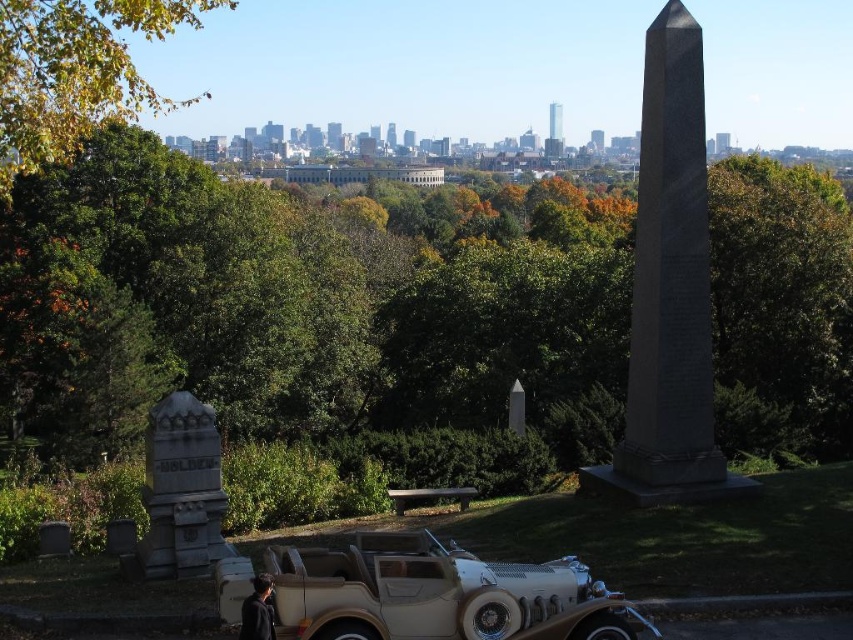
Question: Which of these objects is positioned farthest from the granite obelisk at center?

Choices:
 (A) green leafy tree at upper left
 (B) gray stone monument at lower left

Answer: (A)

Question: Observing the image, what is the correct spatial positioning of granite obelisk at center in reference to green leafy tree at upper left?

Choices:
 (A) below
 (B) above

Answer: (A)

Question: Estimate the real-world distances between objects in this image. Which object is farther from the green leafy tree at upper left?

Choices:
 (A) beige leather car at lower center
 (B) granite obelisk at center

Answer: (B)

Question: Is beige leather car at lower center closer to the viewer compared to green leafy tree at upper left?

Choices:
 (A) yes
 (B) no

Answer: (A)

Question: Among these points, which one is nearest to the camera?

Choices:
 (A) (122, 48)
 (B) (167, 472)
 (C) (640, 260)
 (D) (775, 401)

Answer: (B)

Question: Can you confirm if green leafy tree at center is positioned above beige leather car at lower center?

Choices:
 (A) no
 (B) yes

Answer: (B)